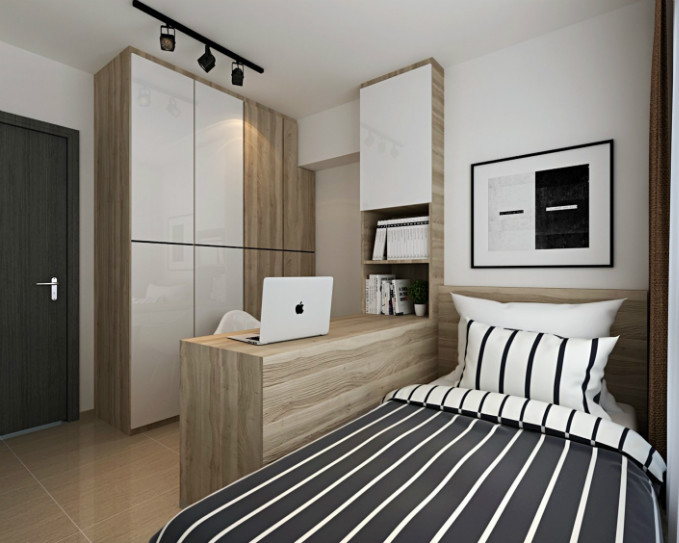
The width and height of the screenshot is (679, 543). I want to click on chair, so click(x=242, y=319).